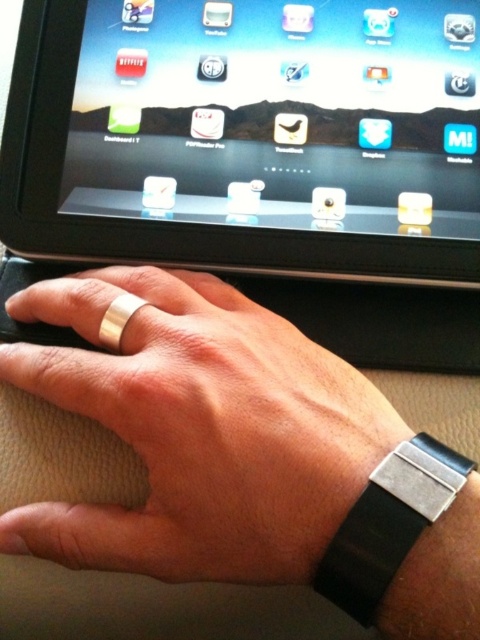
Question: Does black glossy tablet at upper center appear on the right side of silver metallic ring at center?

Choices:
 (A) yes
 (B) no

Answer: (A)

Question: Among these points, which one is farthest from the camera?

Choices:
 (A) (50, 378)
 (B) (252, 179)

Answer: (B)

Question: Which object appears farthest from the camera in this image?

Choices:
 (A) black glossy tablet at upper center
 (B) silver metallic ring at center

Answer: (A)

Question: Is black glossy tablet at upper center to the right of silver metallic ring at center from the viewer's perspective?

Choices:
 (A) yes
 (B) no

Answer: (A)

Question: Which point is closer to the camera?

Choices:
 (A) (239, 458)
 (B) (256, 90)

Answer: (A)

Question: Is black glossy tablet at upper center smaller than silver metallic ring at center?

Choices:
 (A) yes
 (B) no

Answer: (A)